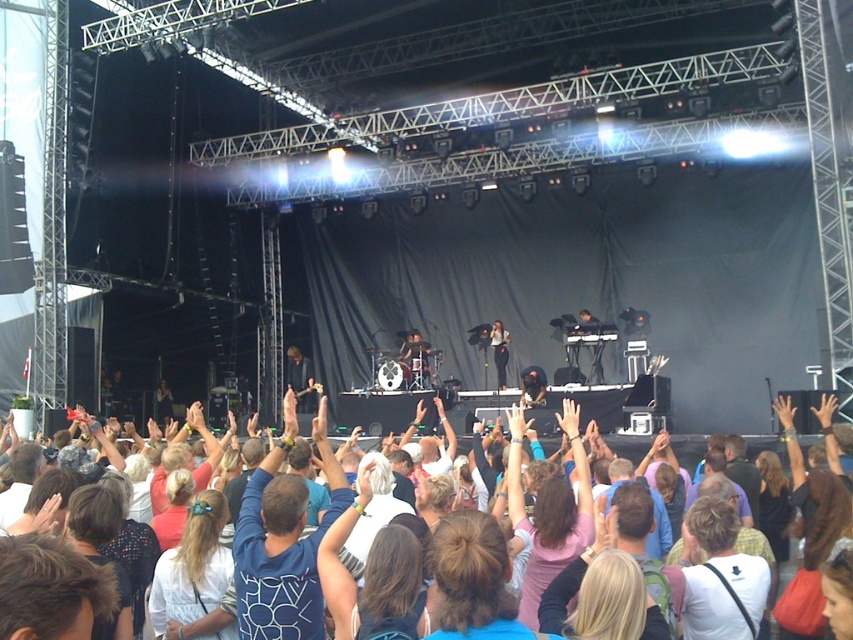
Which is behind, point (795, 433) or point (491, 340)?

The point (491, 340) is behind.

Is point (509, 486) in front of point (502, 369)?

Yes, point (509, 486) is closer to viewer.

Where is `white cotton crowd at center`? Image resolution: width=853 pixels, height=640 pixels. white cotton crowd at center is located at coordinates (x=790, y=436).

Can you confirm if white cotton crowd at center is wider than dark blue shirt at center?

Yes.

Which is in front, point (277, 465) or point (302, 387)?

Point (277, 465)

Is point (791, 454) in front of point (291, 349)?

Yes, point (791, 454) is in front of point (291, 349).

At what (x,y) coordinates should I click in order to perform the action: click on white cotton crowd at center. Please return your answer as a coordinate pair (x, y). Looking at the image, I should click on (790, 436).

Measure the distance between dark blue shirt at center and matte black dress at center.

A distance of 8.83 meters exists between dark blue shirt at center and matte black dress at center.

Is point (312, 404) more distant than point (498, 349)?

That is True.

Where is `dark blue shirt at center`? The height and width of the screenshot is (640, 853). dark blue shirt at center is located at coordinates pos(300,378).